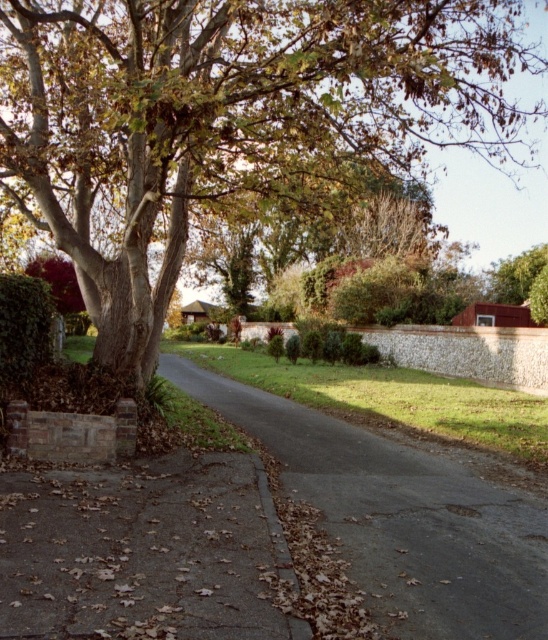
Which is in front, point (242, 593) or point (429, 502)?

Positioned in front is point (242, 593).

Can you confirm if gray concrete driveway at lower left is positioned below dark gray asphalt driveway at center?

Actually, gray concrete driveway at lower left is above dark gray asphalt driveway at center.

Locate an element on the screen. The height and width of the screenshot is (640, 548). gray concrete driveway at lower left is located at coordinates (141, 552).

Which is more to the left, brown textured tree at upper left or dark gray asphalt driveway at center?

Positioned to the left is dark gray asphalt driveway at center.

Is brown textured tree at upper left bigger than dark gray asphalt driveway at center?

Indeed, brown textured tree at upper left has a larger size compared to dark gray asphalt driveway at center.

Which is in front, point (158, 74) or point (396, 458)?

Point (158, 74)

The height and width of the screenshot is (640, 548). I want to click on brown textured tree at upper left, so click(x=231, y=116).

Does point (164, 20) come behind point (89, 524)?

Yes, point (164, 20) is behind point (89, 524).

Who is lower down, brown textured tree at upper left or gray concrete driveway at lower left?

gray concrete driveway at lower left is below.

Is point (71, 227) less distant than point (219, 616)?

No, (71, 227) is behind (219, 616).

Locate an element on the screen. Image resolution: width=548 pixels, height=640 pixels. brown textured tree at upper left is located at coordinates (231, 116).